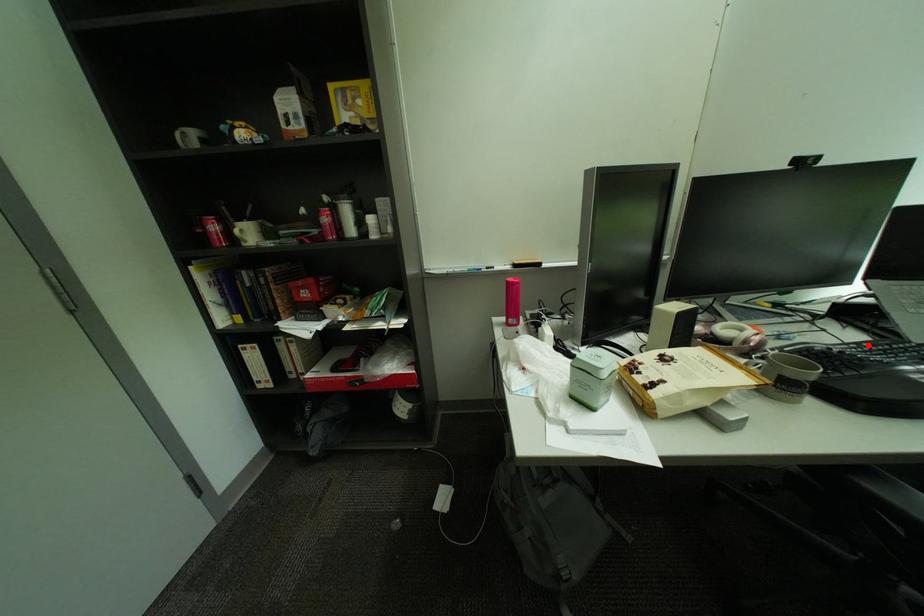
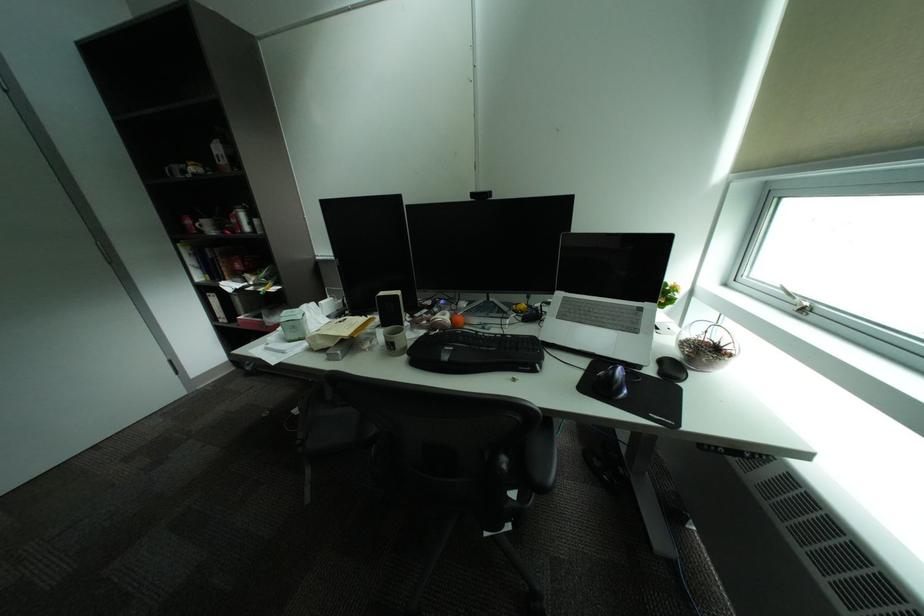
Find the pixel in the second image that matches the highlighted location in the first image.

(516, 336)